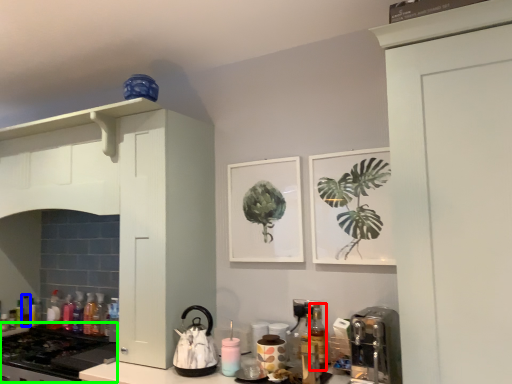
Question: Based on their relative distances, which object is nearer to bottle (highlighted by a red box)? Choose from bottle (highlighted by a blue box) and gas stove (highlighted by a green box).

Choices:
 (A) bottle
 (B) gas stove

Answer: (B)